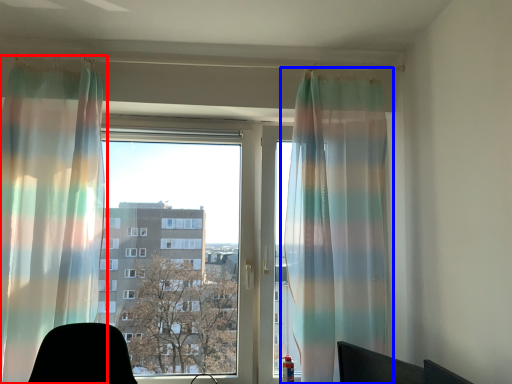
Question: Which of the following is the closest to the observer, curtain (highlighted by a red box) or curtain (highlighted by a blue box)?

Choices:
 (A) curtain
 (B) curtain

Answer: (A)